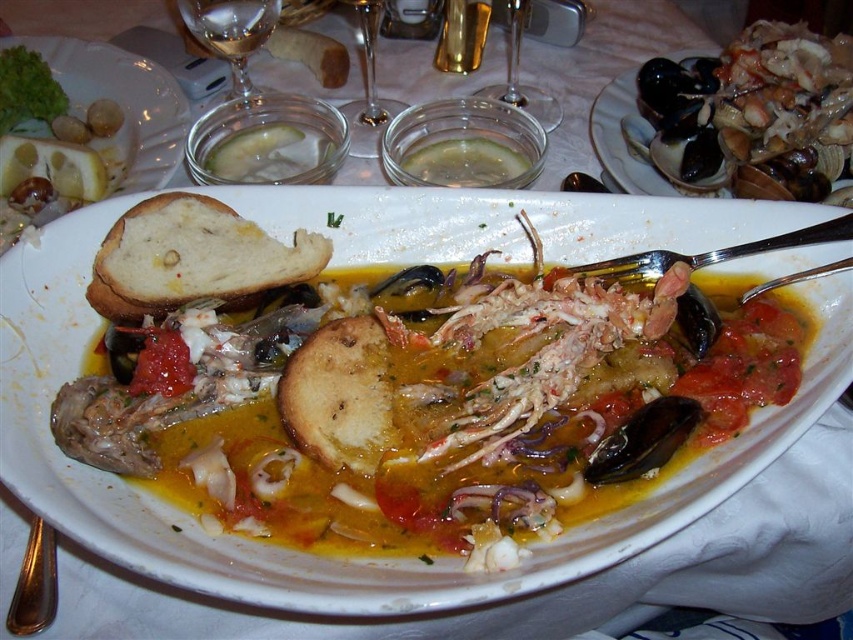
You are a server in a restaurant and need to place a 4.5 inch wide decorative plate between the clear glass wine at upper center and the transparent glass wine glass at center on the table. Based on the spacing between them, will the plate fit without overlapping either item?

The distance between the clear glass wine at upper center and the transparent glass wine glass at center is 4.32 inches. Since the decorative plate is 4.5 inches wide, it is slightly wider than the available space. Therefore, the plate will not fit without overlapping one of the items.

You are a waiter in a restaurant and need to clear the table. You see the transparent glass wine glass at center and the transparent glass at upper center. Which one should you pick up first to avoid blocking the other?

You should pick up the transparent glass at upper center first because it is above the transparent glass wine glass at center, so removing it first will prevent blocking access to the one below.